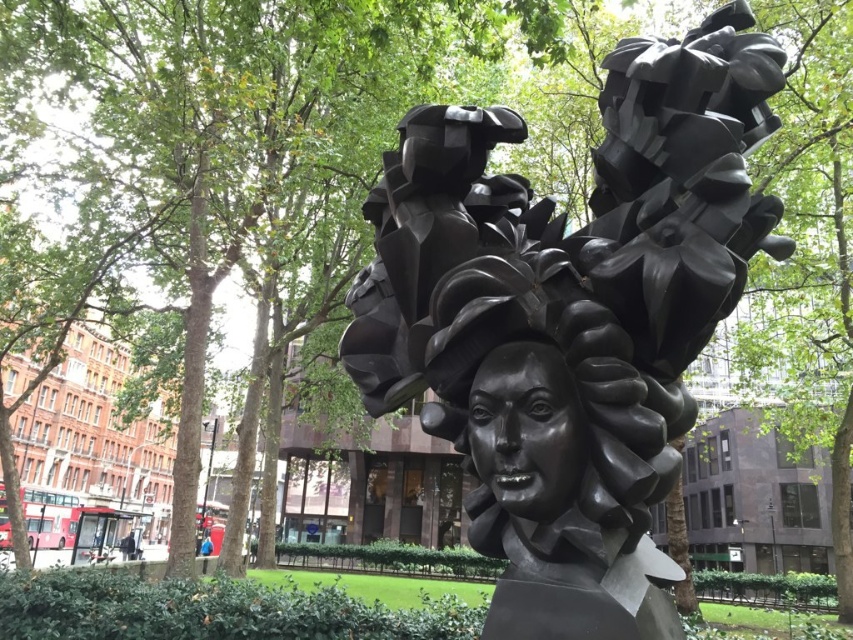
Question: Is the position of polished bronze bust at center less distant than that of shiny black bust at center?

Choices:
 (A) no
 (B) yes

Answer: (B)

Question: Among these points, which one is farthest from the camera?

Choices:
 (A) (573, 477)
 (B) (378, 305)

Answer: (B)

Question: Which object appears farthest from the camera in this image?

Choices:
 (A) shiny black bust at center
 (B) polished bronze bust at center

Answer: (A)

Question: Among these objects, which one is farthest from the camera?

Choices:
 (A) polished bronze bust at center
 (B) shiny black bust at center

Answer: (B)

Question: Does polished bronze bust at center appear over shiny black bust at center?

Choices:
 (A) no
 (B) yes

Answer: (B)

Question: Is polished bronze bust at center bigger than shiny black bust at center?

Choices:
 (A) no
 (B) yes

Answer: (B)